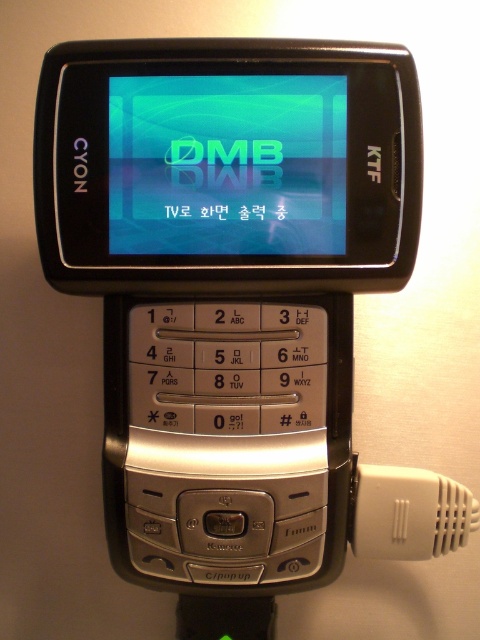
Does matte blue screen at center appear under white plastic connector at lower right?

No.

Does point (141, 221) lie in front of point (377, 509)?

Yes, point (141, 221) is in front of point (377, 509).

The width and height of the screenshot is (480, 640). I want to click on matte blue screen at center, so click(x=227, y=164).